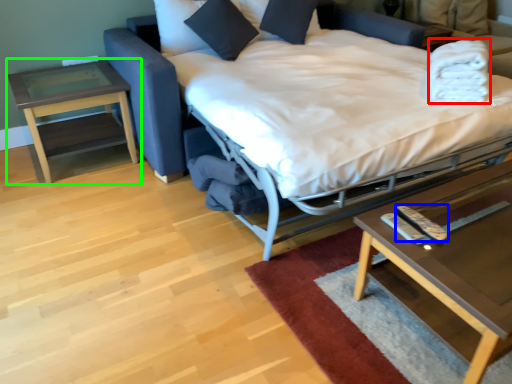
Question: Which is farther away from blanket (highlighted by a red box)? remote (highlighted by a blue box) or table (highlighted by a green box)?

Choices:
 (A) remote
 (B) table

Answer: (B)